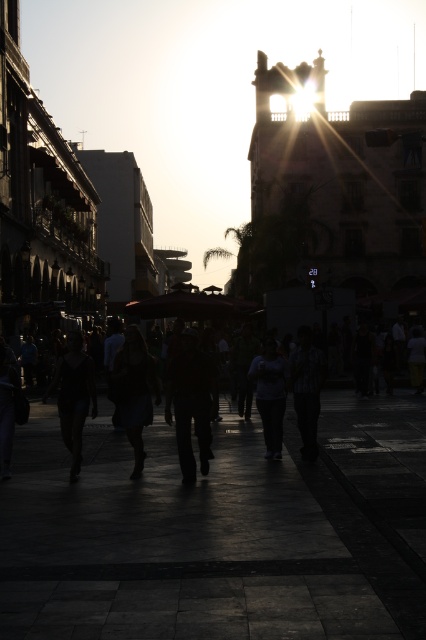
Question: Which object is closer to the camera taking this photo?

Choices:
 (A) dark fabric shirt at center
 (B) dark blue jeans at center
 (C) dark fabric dress at center
 (D) silhouette pedestrians at center

Answer: (D)

Question: Does dark blue dress at center have a greater width compared to matte black umbrella at center?

Choices:
 (A) yes
 (B) no

Answer: (B)

Question: Considering the relative positions of dark fabric dress at center and dark blue jeans at center in the image provided, where is dark fabric dress at center located with respect to dark blue jeans at center?

Choices:
 (A) below
 (B) above

Answer: (A)

Question: Which of the following is the closest to the observer?

Choices:
 (A) (69, 404)
 (B) (279, 394)
 (C) (408, 442)
 (D) (291, 513)

Answer: (D)

Question: Which point is closer to the camera?

Choices:
 (A) (19, 454)
 (B) (258, 380)
 (C) (141, 353)
 (D) (310, 364)

Answer: (C)

Question: Can you confirm if dark fabric shirt at center is positioned above dark blue jeans at center?

Choices:
 (A) no
 (B) yes

Answer: (B)